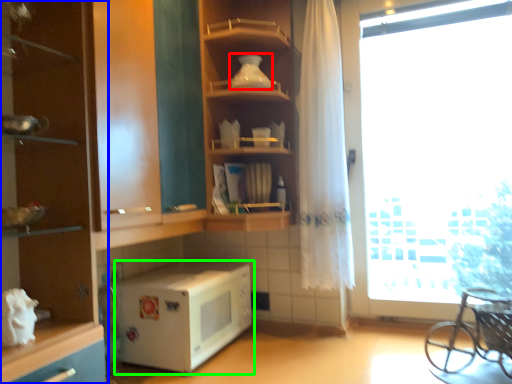
Question: Considering the real-world distances, which object is farthest from appliance (highlighted by a red box)? cabinetry (highlighted by a blue box) or microwave oven (highlighted by a green box)?

Choices:
 (A) cabinetry
 (B) microwave oven

Answer: (B)